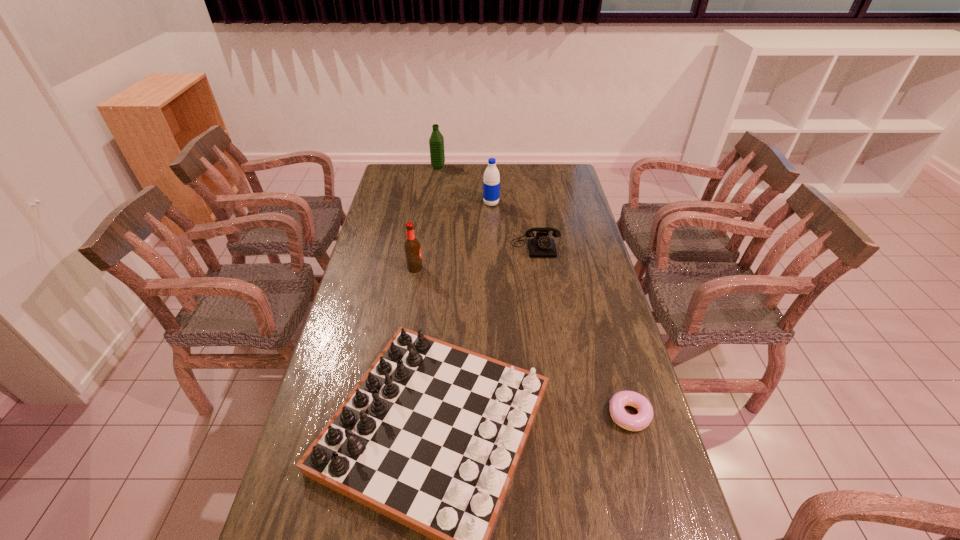
Where is `vacant space at the far left corner`? The width and height of the screenshot is (960, 540). vacant space at the far left corner is located at coordinates (411, 164).

Locate an element on the screen. Image resolution: width=960 pixels, height=540 pixels. free space between the beer bottle and the second farthest object is located at coordinates (453, 236).

In order to click on free space between the doughnut and the telephone in this screenshot , I will do `click(583, 330)`.

The width and height of the screenshot is (960, 540). I want to click on unoccupied area between the second shortest object and the farthest object, so click(x=487, y=206).

Find the location of `free space between the rightmost object and the second shortest object`. free space between the rightmost object and the second shortest object is located at coordinates (x=583, y=330).

Image resolution: width=960 pixels, height=540 pixels. I want to click on vacant area between the farther water bottle and the third nearest object, so [426, 218].

This screenshot has height=540, width=960. I want to click on free area in between the third farthest object and the rightmost object, so click(x=583, y=330).

Locate an element on the screen. Image resolution: width=960 pixels, height=540 pixels. vacant region between the farthest object and the doughnut is located at coordinates (534, 291).

This screenshot has height=540, width=960. I want to click on vacant space that's between the fifth tallest object and the beer bottle, so click(475, 257).

Select which object appears as the second closest to the telephone. Please provide its 2D coordinates. Your answer should be formatted as a tuple, i.e. [(x, y)], where the tuple contains the x and y coordinates of a point satisfying the conditions above.

[(412, 247)]